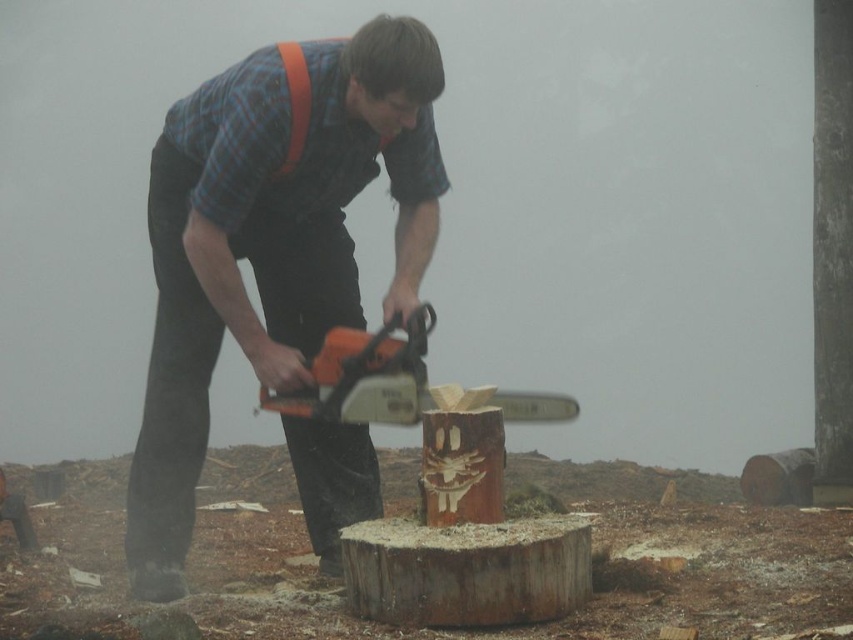
Who is lower down, orange matte chainsaw at center or orange fabric suspenders at upper center?

Positioned lower is orange matte chainsaw at center.

The width and height of the screenshot is (853, 640). I want to click on orange matte chainsaw at center, so click(270, 244).

Does rustic wood carving at center appear under orange fabric suspenders at upper center?

Yes, rustic wood carving at center is below orange fabric suspenders at upper center.

Find the location of `rustic wood carving at center`. rustic wood carving at center is located at coordinates (466, 570).

This screenshot has width=853, height=640. What are the coordinates of `rustic wood carving at center` in the screenshot? It's located at (466, 570).

Measure the distance from orange matte chainsaw at center to orange plastic chainsaw at center.

orange matte chainsaw at center and orange plastic chainsaw at center are 14.64 inches apart.

The width and height of the screenshot is (853, 640). In order to click on orange matte chainsaw at center in this screenshot , I will do `click(270, 244)`.